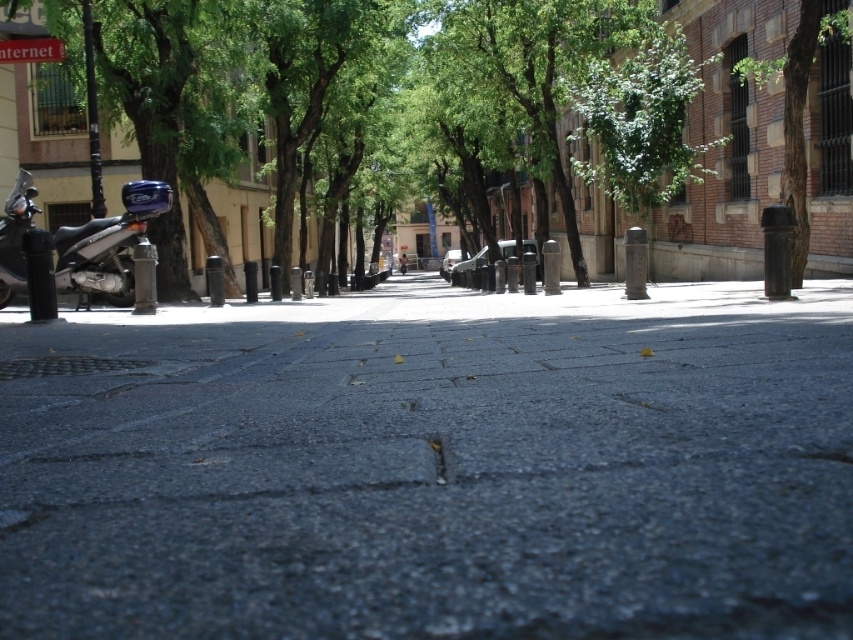
You are a delivery person trying to navigate through the narrow alley between the green leafy tree at upper center and the brown rough bark tree at right. Based on the scene, can you estimate if the space between them is wide enough for your delivery van which is 2 meters wide?

The green leafy tree at upper center might be wider than brown rough bark tree at right, so it is uncertain whether the alley between them is wide enough for a 2 meter wide van. Check the actual width before proceeding.

Consider the image. You are standing on the road in the urban street scene. There are two points marked on the ground at coordinates point (625, 125) and point (65, 244). Which point is closer to your current position?

Point (65, 244) is closer to your current position because it is closer to the camera than point (625, 125).